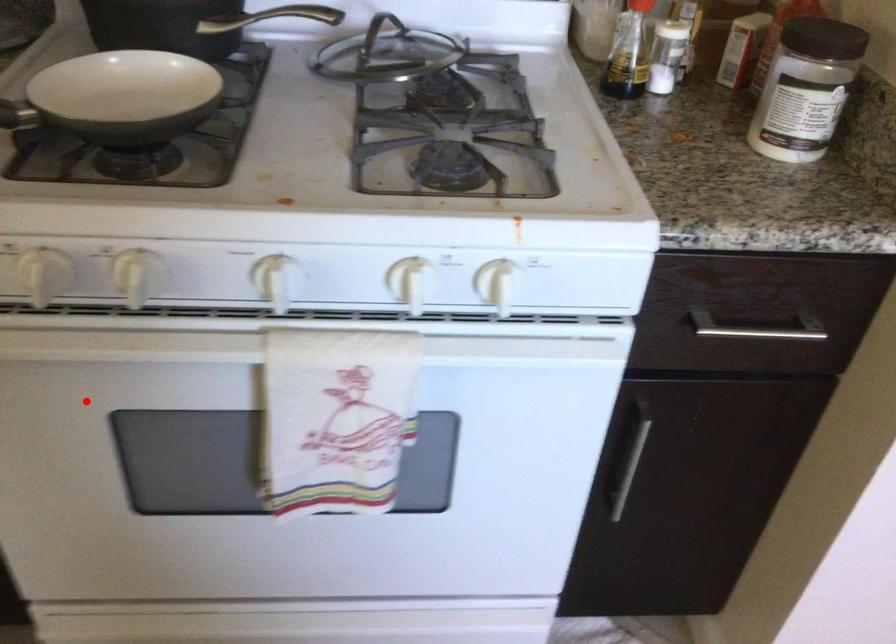
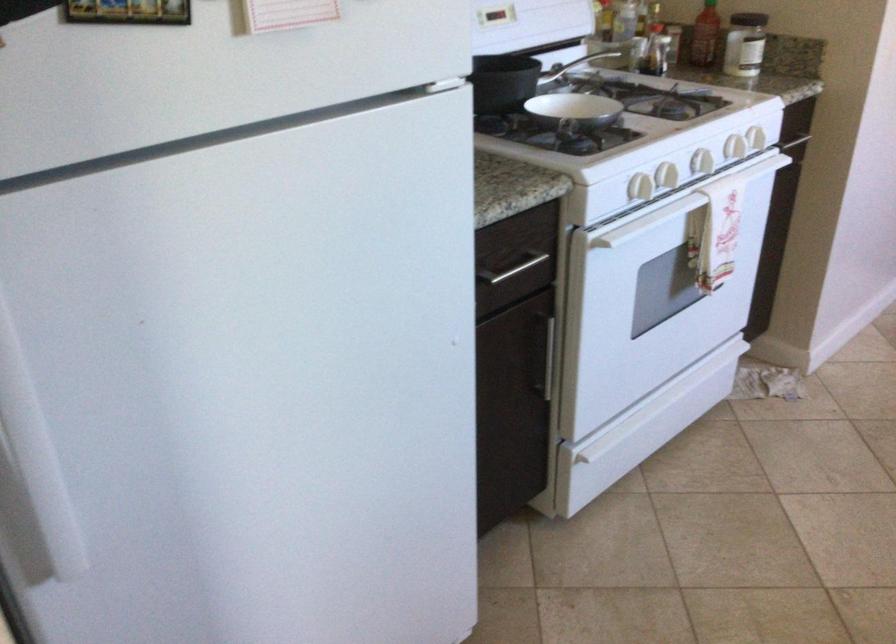
Question: I am providing you with two images of the same scene from different viewpoints. In image1, a red point is highlighted. Considering the same 3D point in image2, which of the following is correct?

Choices:
 (A) It is closer
 (B) It is farther

Answer: (B)